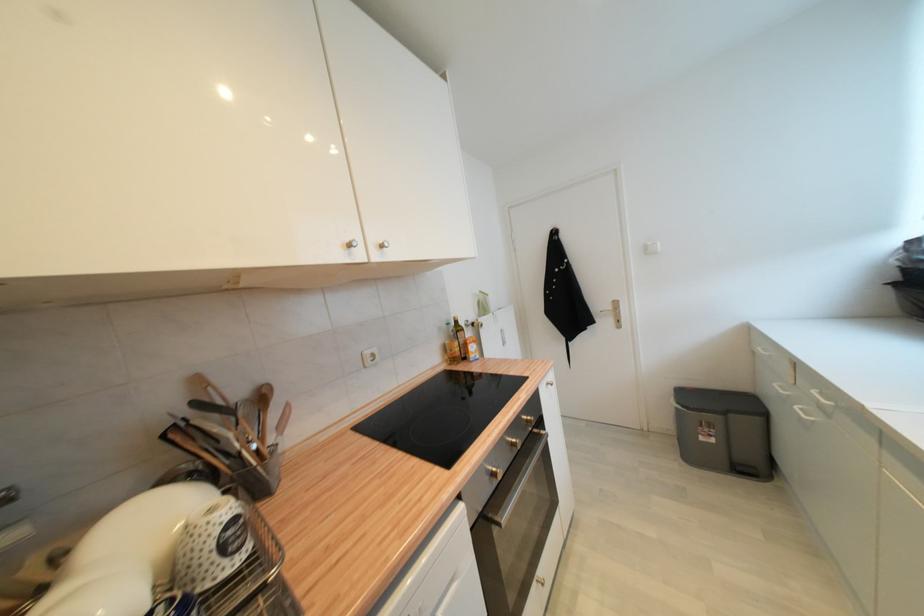
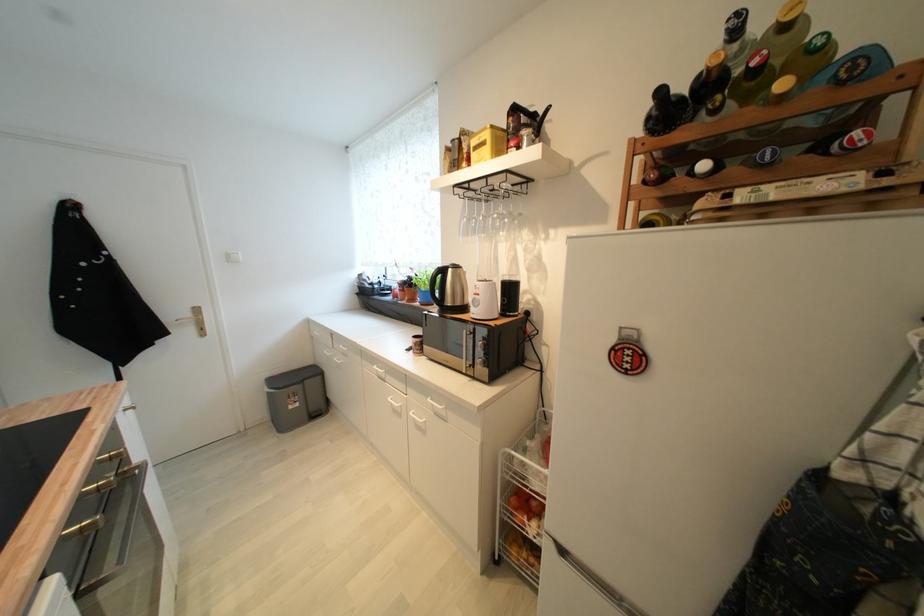
Find the pixel in the second image that matches point (615, 323) in the first image.

(197, 331)